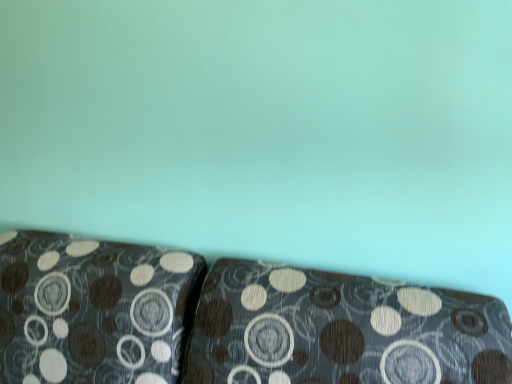
What do you see at coordinates (230, 321) in the screenshot? I see `dark gray fabric cushion at lower center` at bounding box center [230, 321].

You are a GUI agent. You are given a task and a screenshot of the screen. Output one action in this format:
    pyautogui.click(x=<x>, y=<y>)
    Task: Click on the dark gray fabric cushion at lower center
    Image resolution: width=512 pixels, height=384 pixels.
    Given the screenshot: What is the action you would take?
    pyautogui.click(x=230, y=321)

The width and height of the screenshot is (512, 384). Identify the location of dark gray fabric cushion at lower center. (230, 321).